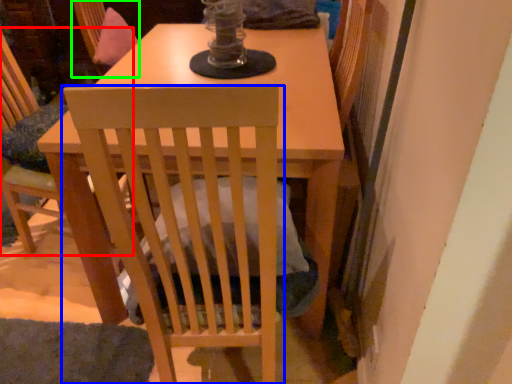
Question: Estimate the real-world distances between objects in this image. Which object is farther from chair (highlighted by a red box), chair (highlighted by a blue box) or swivel chair (highlighted by a green box)?

Choices:
 (A) chair
 (B) swivel chair

Answer: (A)